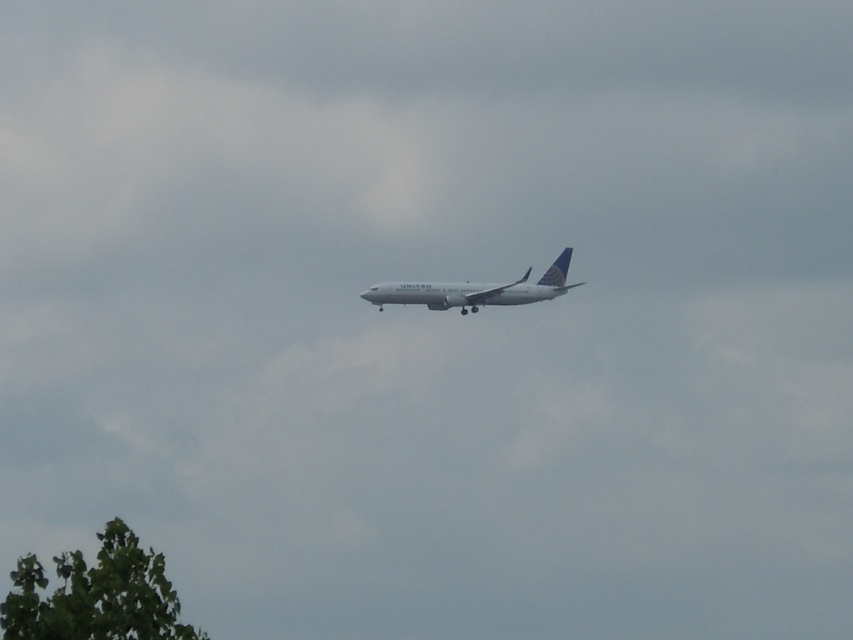
You are a pilot flying the white matte airplane at center and need to avoid obstacles. Is the green leafy tree at lower left located below or above your aircraft?

The green leafy tree at lower left is positioned under the white matte airplane at center, so it is located below your aircraft.

You are a pilot flying the white matte airplane at center and need to navigate around the green leafy tree at lower left. Based on their sizes, can you estimate if the tree is smaller than the airplane?

The green leafy tree at lower left is narrower than the white matte airplane at center, so yes, the tree is smaller than the airplane.